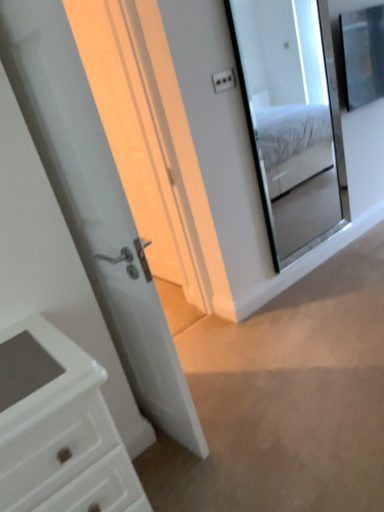
Question: From a real-world perspective, is clear glass mirror at upper right positioned above or below white glossy door at center?

Choices:
 (A) below
 (B) above

Answer: (B)

Question: In terms of size, does clear glass mirror at upper right appear bigger or smaller than white glossy door at center?

Choices:
 (A) small
 (B) big

Answer: (A)

Question: Estimate the real-world distances between objects in this image. Which object is closer to the white glossy door at center?

Choices:
 (A) white plastic light switch at upper center
 (B) white glossy door at center
 (C) clear glass mirror at upper right

Answer: (A)

Question: Which object is the farthest from the white plastic light switch at upper center?

Choices:
 (A) white glossy door at center
 (B) white glossy door at center
 (C) clear glass mirror at upper right

Answer: (C)